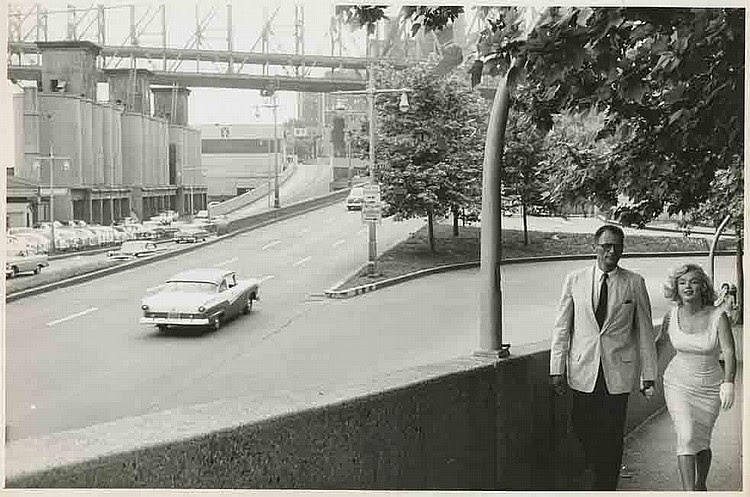
Find the location of `wall`. wall is located at coordinates (428, 388).